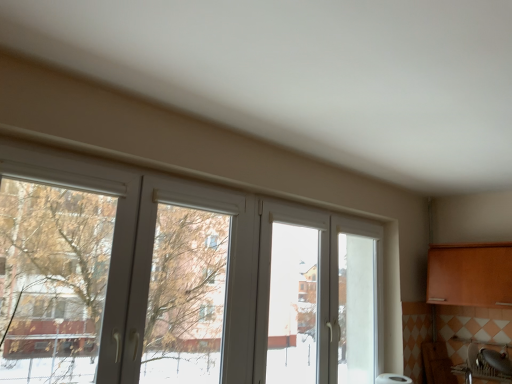
Question: Which is correct: white plastic window at center is inside matte silver sink at lower right, or outside of it?

Choices:
 (A) outside
 (B) inside

Answer: (A)

Question: In the image, is white plastic window at center on the left side or the right side of matte silver sink at lower right?

Choices:
 (A) left
 (B) right

Answer: (A)

Question: Considering the positions of point (182, 230) and point (508, 370), is point (182, 230) closer or farther from the camera than point (508, 370)?

Choices:
 (A) farther
 (B) closer

Answer: (B)

Question: From the image's perspective, is matte silver sink at lower right located above or below white plastic window at center?

Choices:
 (A) above
 (B) below

Answer: (B)

Question: In the image, is matte silver sink at lower right positioned in front of or behind white plastic window at center?

Choices:
 (A) behind
 (B) front

Answer: (A)

Question: Which is correct: matte silver sink at lower right is inside white plastic window at center, or outside of it?

Choices:
 (A) inside
 (B) outside

Answer: (B)

Question: From a real-world perspective, is matte silver sink at lower right physically located above or below white plastic window at center?

Choices:
 (A) below
 (B) above

Answer: (A)